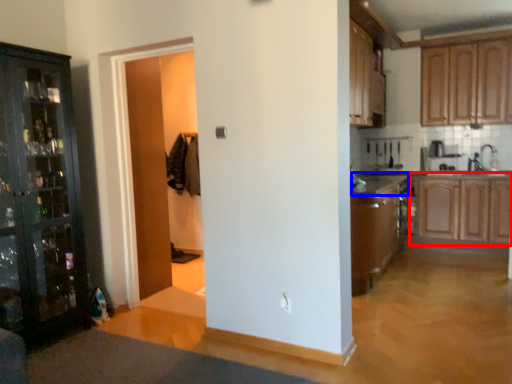
Question: Which of the following is the closest to the observer, cabinetry (highlighted by a red box) or counter top (highlighted by a blue box)?

Choices:
 (A) cabinetry
 (B) counter top

Answer: (B)